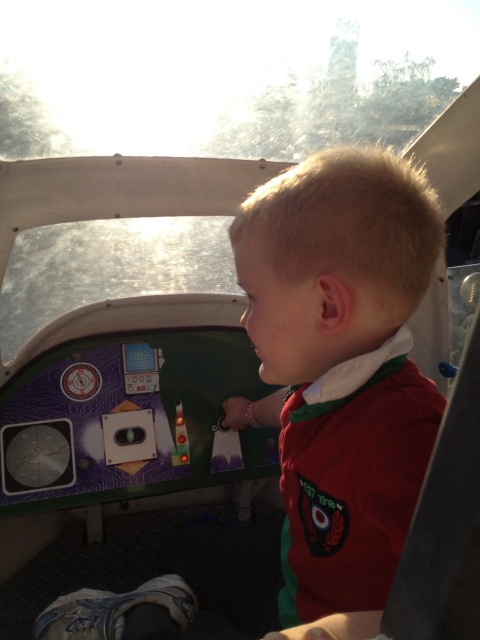
Question: Is matte red shirt at center above translucent plastic buttons at center?

Choices:
 (A) no
 (B) yes

Answer: (A)

Question: Among these objects, which one is farthest from the camera?

Choices:
 (A) matte red shirt at center
 (B) translucent plastic buttons at center

Answer: (B)

Question: Which point is closer to the camera taking this photo?

Choices:
 (A) (292, 428)
 (B) (177, 433)

Answer: (A)

Question: Can you confirm if matte red shirt at center is wider than translucent plastic buttons at center?

Choices:
 (A) yes
 (B) no

Answer: (A)

Question: Which point appears closest to the camera in this image?

Choices:
 (A) (184, 436)
 (B) (316, 579)

Answer: (B)

Question: Does matte red shirt at center come behind translucent plastic buttons at center?

Choices:
 (A) yes
 (B) no

Answer: (B)